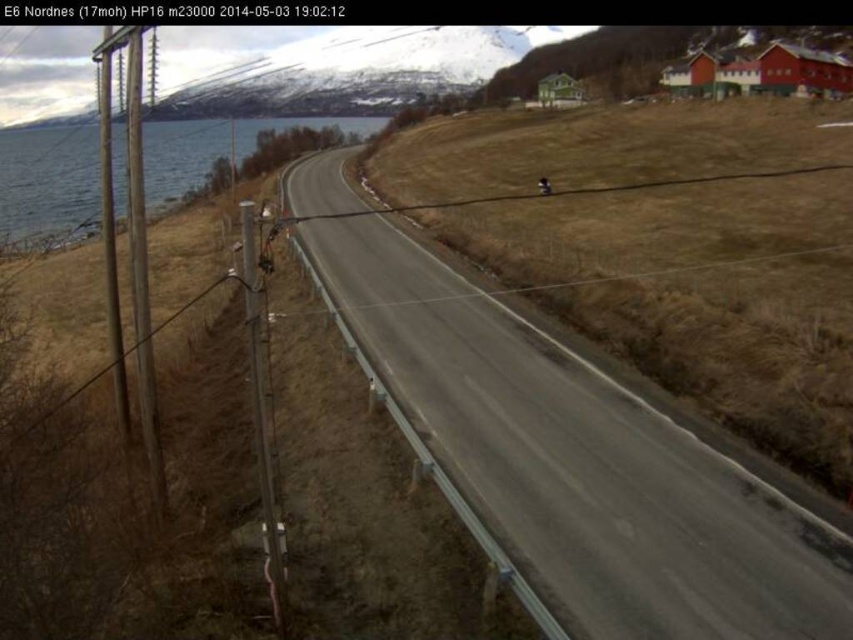
What do you see at coordinates (572, 452) in the screenshot? The image size is (853, 640). I see `gray asphalt highway at center` at bounding box center [572, 452].

Is gray asphalt highway at center to the left of blue water at left from the viewer's perspective?

No, gray asphalt highway at center is not to the left of blue water at left.

What do you see at coordinates (572, 452) in the screenshot? I see `gray asphalt highway at center` at bounding box center [572, 452].

At what (x,y) coordinates should I click in order to perform the action: click on gray asphalt highway at center. Please return your answer as a coordinate pair (x, y). The width and height of the screenshot is (853, 640). Looking at the image, I should click on (572, 452).